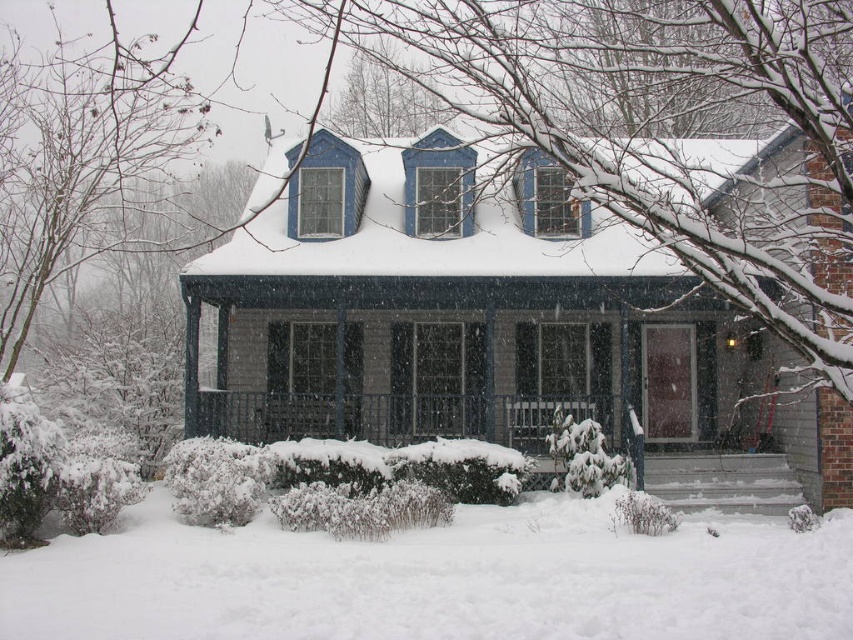
You are planning to build a snowman in the area shown in the image. The snowman requires a base that is wider than the smooth gray porch at center. Based on the scene, can you determine if the white fluffy snow at lower center is suitable for this purpose?

The white fluffy snow at lower center might be wider than the smooth gray porch at center, so it could potentially provide a sufficient base for the snowman if its width meets the requirement.

You are standing in front of the snowy house and want to step onto the smooth gray porch at center. Is the white fluffy snow at lower center between you and the porch?

Yes, the white fluffy snow at lower center is between you and the smooth gray porch at center because it is closer to the viewer than the porch.

You are standing in front of the house and want to step onto the snow at the lower center. Based on the coordinates provided, is the white fluffy snow at lower center located closer to the left or right side of the image?

The white fluffy snow at lower center is located at coordinates point (437, 579). Since the x coordinate is 0.906, which is closer to 1.0, the right side of the image, the white fluffy snow at lower center is closer to the right side of the image.